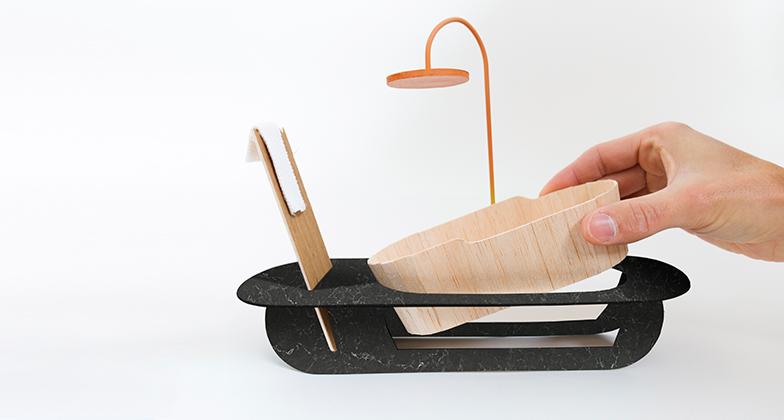
This screenshot has width=784, height=420. In order to click on towel in this screenshot , I will do `click(289, 171)`.